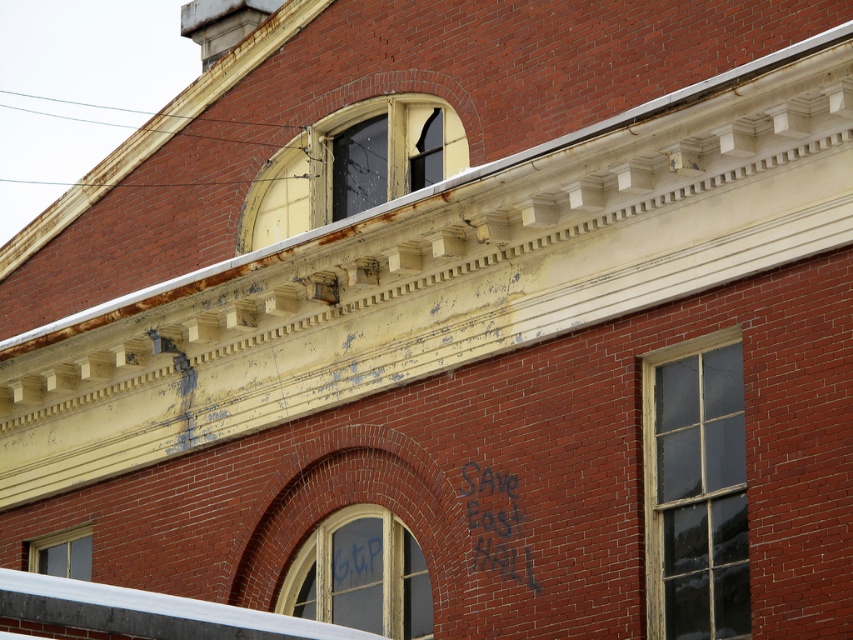
Question: Is yellow glass window at upper center to the left of clear glass window at center from the viewer's perspective?

Choices:
 (A) no
 (B) yes

Answer: (B)

Question: Considering the real-world distances, which object is farthest from the clear glass window at center?

Choices:
 (A) wooden window at center
 (B) yellow glass window at upper center

Answer: (B)

Question: Which of the following is the closest to the observer?

Choices:
 (A) (653, 360)
 (B) (370, 630)

Answer: (A)

Question: Can you confirm if wooden window at center is thinner than clear glass window at lower left?

Choices:
 (A) no
 (B) yes

Answer: (A)

Question: Can you confirm if clear glass window at center is positioned to the right of clear glass window at lower left?

Choices:
 (A) no
 (B) yes

Answer: (B)

Question: Which of the following is the farthest from the observer?

Choices:
 (A) (741, 544)
 (B) (67, 554)
 (C) (372, 198)

Answer: (B)